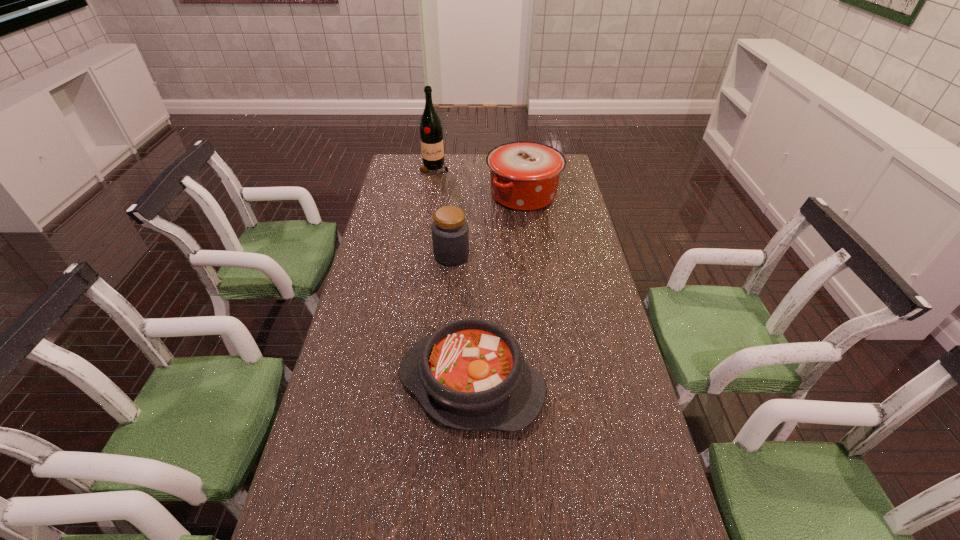
At what (x,y) coordinates should I click in order to perform the action: click on casserole situated at the far edge. Please return your answer as a coordinate pair (x, y). The width and height of the screenshot is (960, 540). Looking at the image, I should click on (524, 176).

Where is `object situated at the left edge`? The width and height of the screenshot is (960, 540). object situated at the left edge is located at coordinates (431, 134).

Locate an element on the screen. Image resolution: width=960 pixels, height=540 pixels. object positioned at the right edge is located at coordinates (524, 176).

The height and width of the screenshot is (540, 960). In order to click on object located at the far left corner in this screenshot , I will do `click(431, 134)`.

I want to click on object that is at the far right corner, so click(x=524, y=176).

Locate an element on the screen. free space at the far edge of the desktop is located at coordinates (458, 161).

Locate an element on the screen. The image size is (960, 540). vacant space at the left edge of the desktop is located at coordinates (386, 198).

Locate an element on the screen. This screenshot has height=540, width=960. vacant space at the right edge of the desktop is located at coordinates (560, 197).

In the image, there is a desktop. Where is `vacant space at the far right corner`? The image size is (960, 540). vacant space at the far right corner is located at coordinates (564, 177).

Image resolution: width=960 pixels, height=540 pixels. I want to click on empty space that is in between the farther casserole and the jar, so click(488, 225).